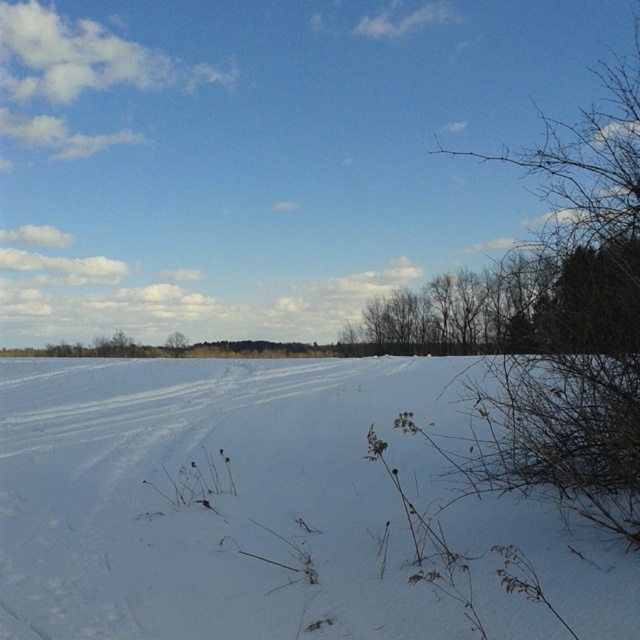
Question: Which point is closer to the camera taking this photo?

Choices:
 (A) (524, 356)
 (B) (179, 348)
 (C) (260, 369)

Answer: (A)

Question: Which object appears closest to the camera in this image?

Choices:
 (A) white powdery snow at center
 (B) green leafy tree at center
 (C) brown bare branches at right

Answer: (A)

Question: Is white powdery snow at center behind green leafy tree at center?

Choices:
 (A) yes
 (B) no

Answer: (B)

Question: Which point is closer to the camera?

Choices:
 (A) (616, 108)
 (B) (172, 342)
 (C) (376, 490)

Answer: (A)

Question: Does white powdery snow at center appear over brown bare branches at right?

Choices:
 (A) no
 (B) yes

Answer: (A)

Question: Observing the image, what is the correct spatial positioning of brown bare branches at right in reference to green leafy tree at center?

Choices:
 (A) above
 (B) below

Answer: (A)